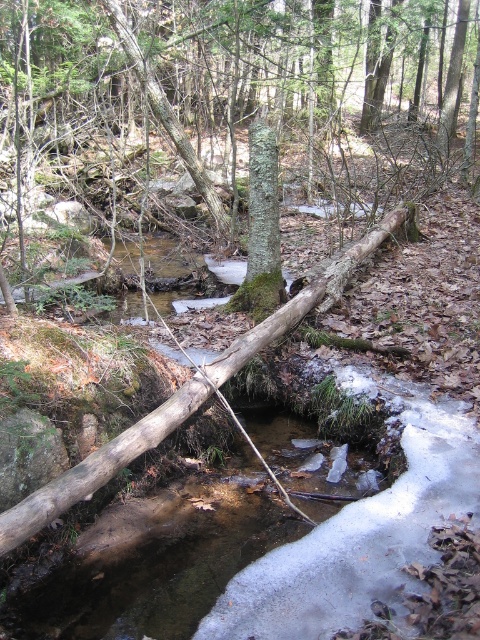
Question: Which point is closer to the camera?

Choices:
 (A) green rough bark tree at center
 (B) clear water at center
 (C) green rough bark tree trunk at center

Answer: (B)

Question: Does clear water at center lie behind green rough bark tree trunk at center?

Choices:
 (A) no
 (B) yes

Answer: (A)

Question: Which object is positioned closest to the clear water at center?

Choices:
 (A) green rough bark tree trunk at center
 (B) green rough bark tree at center

Answer: (A)

Question: Which object appears closest to the camera in this image?

Choices:
 (A) green rough bark tree at center
 (B) clear water at center
 (C) green rough bark tree trunk at center

Answer: (B)

Question: Is green rough bark tree at center to the right of green rough bark tree trunk at center from the viewer's perspective?

Choices:
 (A) no
 (B) yes

Answer: (B)

Question: Does green rough bark tree at center appear on the left side of green rough bark tree trunk at center?

Choices:
 (A) no
 (B) yes

Answer: (A)